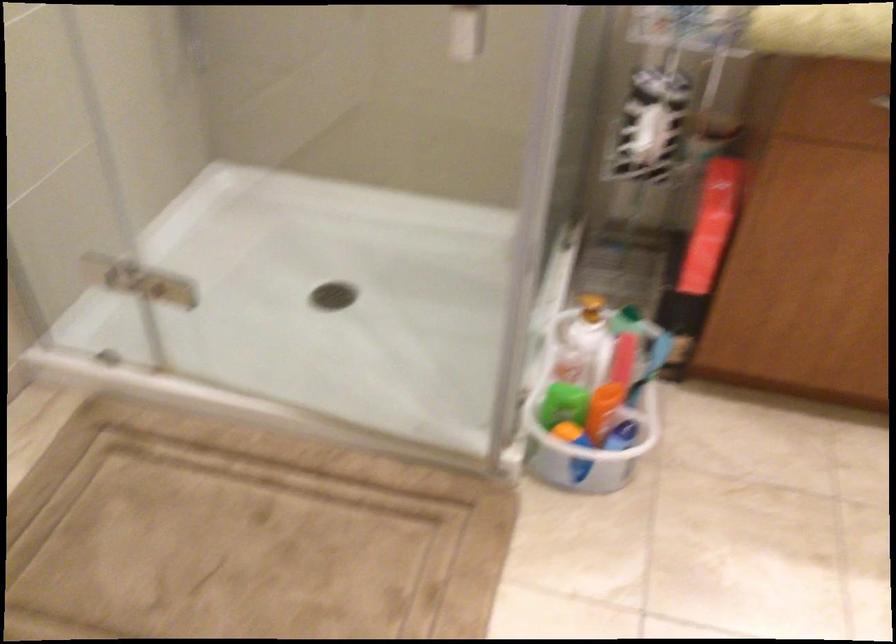
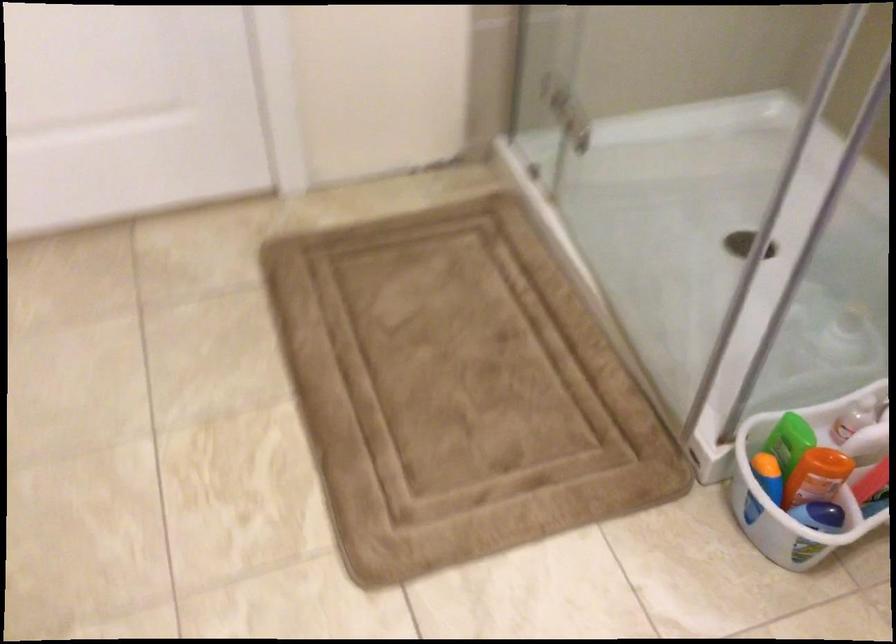
In the second image, find the point that corresponds to (140,279) in the first image.

(583, 107)